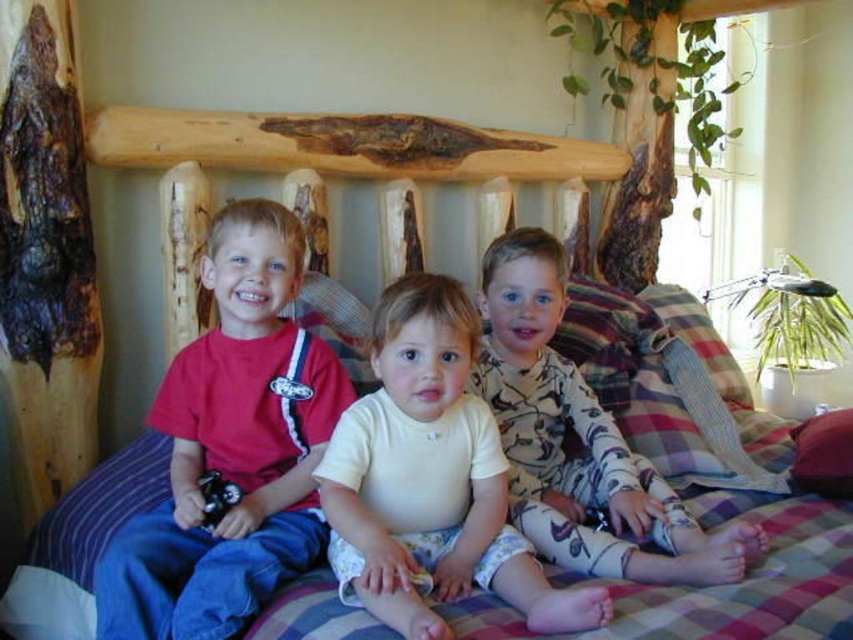
Is matte red t-shirt at left above purple fabric pillow at center?

Yes.

Does matte red t-shirt at left have a lesser height compared to purple fabric pillow at center?

Incorrect, matte red t-shirt at left's height does not fall short of purple fabric pillow at center's.

Is point (238, 461) positioned before point (837, 477)?

Yes.

This screenshot has height=640, width=853. In order to click on matte red t-shirt at left in this screenshot , I will do `click(231, 445)`.

Between matte red t-shirt at left and smooth cream shirt at center, which one is positioned higher?

matte red t-shirt at left is above.

Can you confirm if matte red t-shirt at left is positioned below smooth cream shirt at center?

Incorrect, matte red t-shirt at left is not positioned below smooth cream shirt at center.

Does point (218, 422) come behind point (451, 595)?

Yes.

The width and height of the screenshot is (853, 640). I want to click on matte red t-shirt at left, so click(x=231, y=445).

Who is shorter, matte red t-shirt at left or camouflage pajamas at center?

camouflage pajamas at center

Looking at this image, does matte red t-shirt at left have a lesser width compared to camouflage pajamas at center?

Yes.

Identify the location of matte red t-shirt at left. (231, 445).